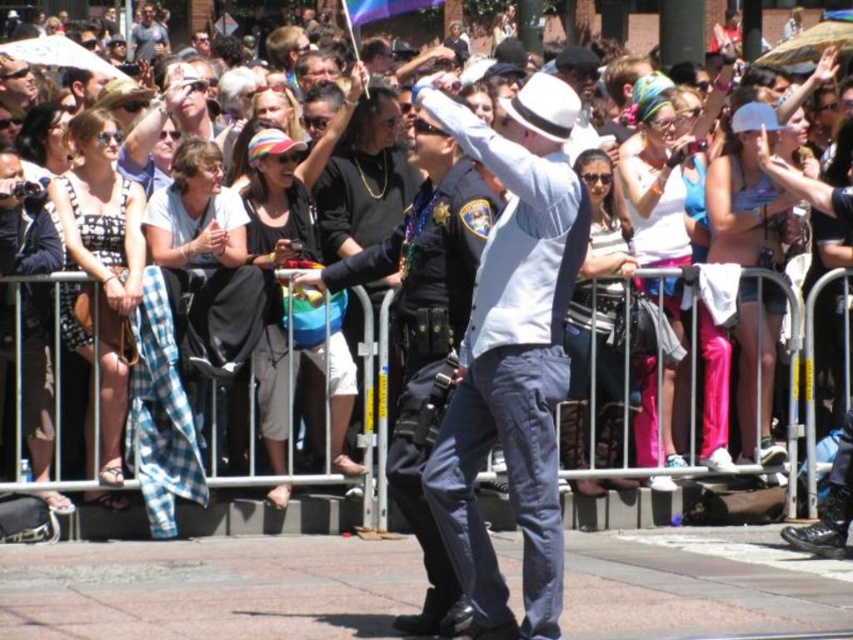
Question: Is white matte hat at center positioned behind metallic silver rail at center?

Choices:
 (A) no
 (B) yes

Answer: (A)

Question: Which of these objects is positioned farthest from the matte black shirt at upper center?

Choices:
 (A) metallic silver rail at center
 (B) white matte fedora at center
 (C) white matte hat at center
 (D) matte black tank top at left

Answer: (B)

Question: Is white matte fedora at center smaller than matte black tank top at left?

Choices:
 (A) no
 (B) yes

Answer: (A)

Question: Which of the following is the farthest from the observer?

Choices:
 (A) (184, 522)
 (B) (26, 221)
 (C) (155, 52)
 (D) (505, 352)

Answer: (C)

Question: Which of the following is the farthest from the observer?

Choices:
 (A) matte black tank top at left
 (B) white matte fedora at center
 (C) white matte hat at center

Answer: (A)

Question: Does white matte hat at center have a greater width compared to metallic silver rail at center?

Choices:
 (A) no
 (B) yes

Answer: (A)